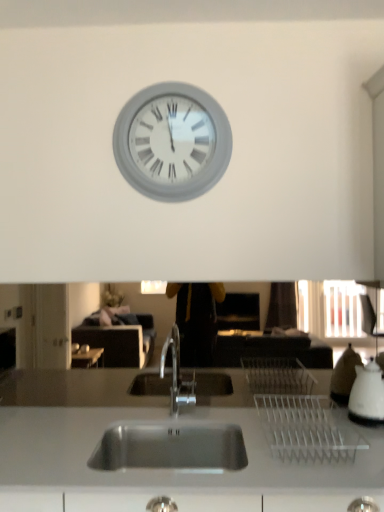
The width and height of the screenshot is (384, 512). Identify the location of vacant location below white matte clock at upper center (from a real-world perspective). (157, 408).